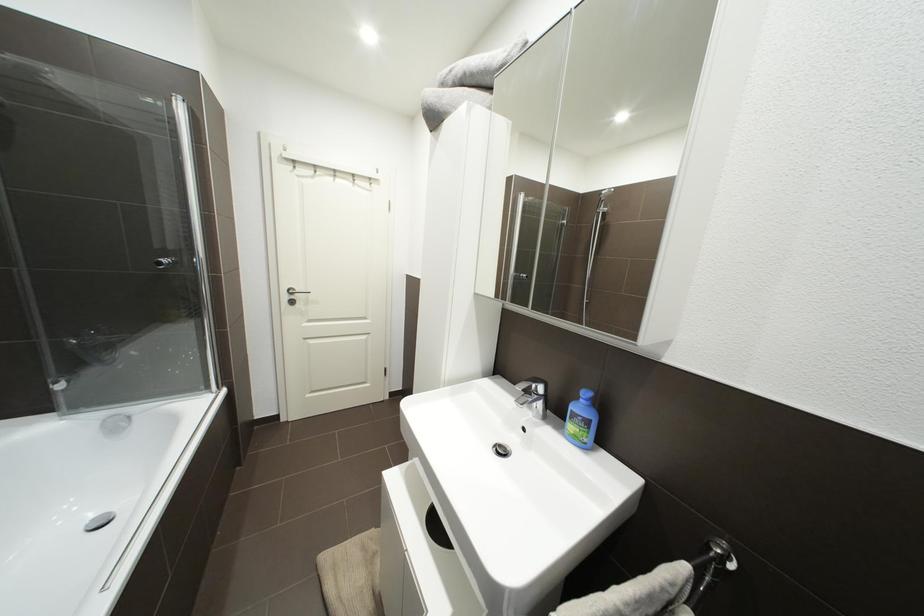
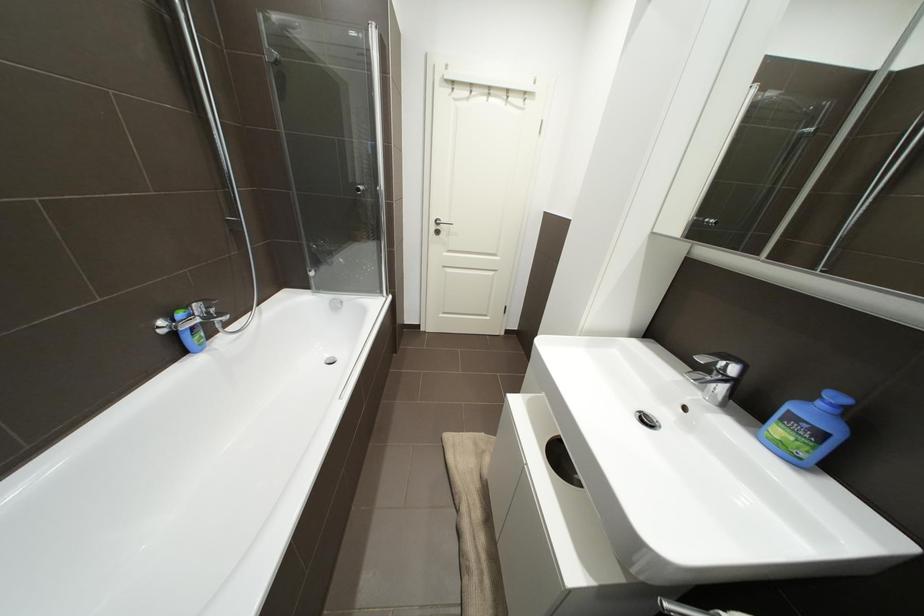
Question: Which direction would the cameraman need to move to produce the second image? Reply with the corresponding letter.

Choices:
 (A) Left
 (B) Right
 (C) Forward
 (D) Backward

Answer: (A)